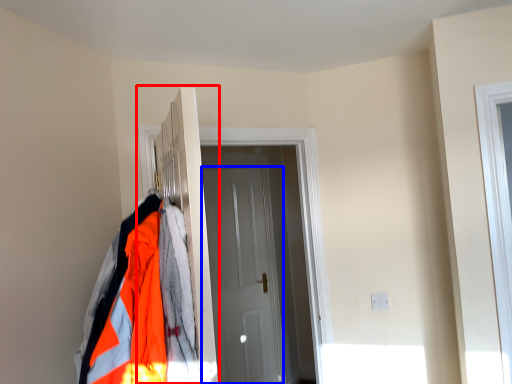
Question: Which object appears closest to the camera in this image, closet (highlighted by a red box) or door (highlighted by a blue box)?

Choices:
 (A) closet
 (B) door

Answer: (A)